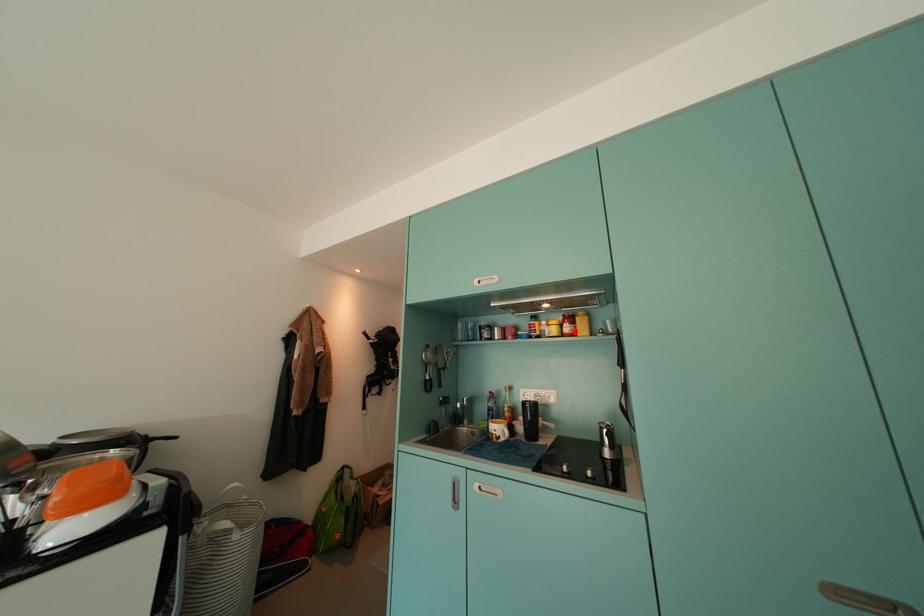
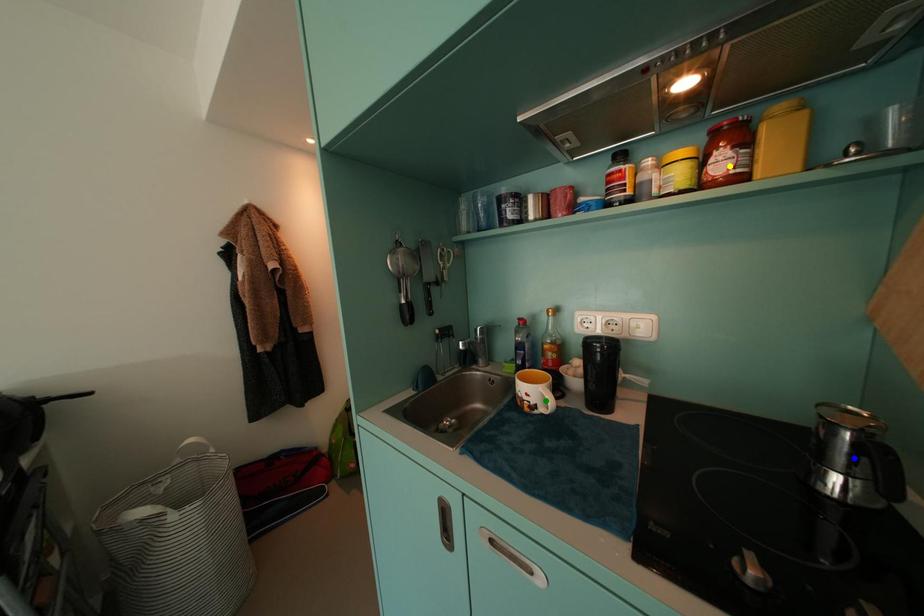
Question: I am providing you with two images of the same scene from different viewpoints. A red point is marked on the first image. You are given multiple points on the second image. Which point in image 2 is actually the same real-world point as the red point in image 1?

Choices:
 (A) green point
 (B) blue point
 (C) yellow point

Answer: (C)